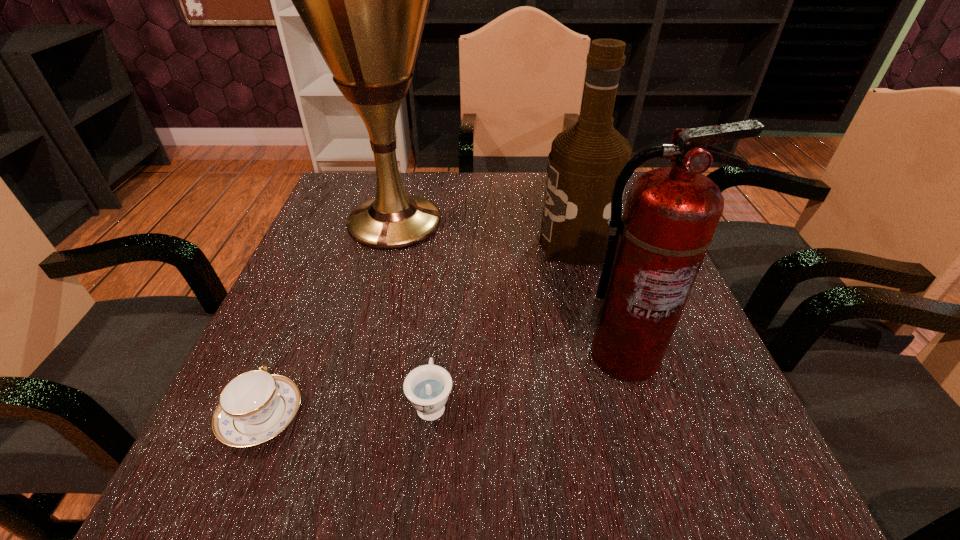
I want to click on free space located on the side of the right teacup with the handle, so click(439, 321).

You are a GUI agent. You are given a task and a screenshot of the screen. Output one action in this format:
    pyautogui.click(x=<x>, y=<y>)
    Task: Click on the vacant space located 0.090m on the side of the right teacup with the handle
    The image size is (960, 540).
    Given the screenshot: What is the action you would take?
    pyautogui.click(x=438, y=334)

The width and height of the screenshot is (960, 540). What are the coordinates of `free point located on the side of the right teacup with the handle` in the screenshot? It's located at (446, 244).

Identify the location of free region located 0.200m on the side with the handle of the left teacup. This screenshot has width=960, height=540. (313, 294).

Locate an element on the screen. vacant space located on the side with the handle of the left teacup is located at coordinates (x=316, y=287).

Identify the location of vacant space located on the side with the handle of the left teacup. The image size is (960, 540). (328, 258).

The width and height of the screenshot is (960, 540). Find the location of `object situated at the far edge`. object situated at the far edge is located at coordinates [364, 0].

Where is `object located at the near edge`? Image resolution: width=960 pixels, height=540 pixels. object located at the near edge is located at coordinates (255, 406).

Find the location of `trophy cup positioned at the left edge`. trophy cup positioned at the left edge is located at coordinates (364, 0).

What are the coordinates of `teacup present at the left edge` in the screenshot? It's located at (255, 406).